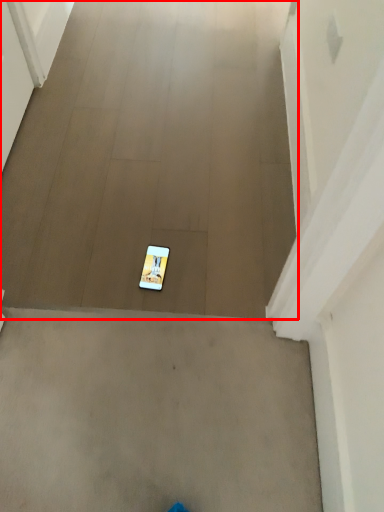
Question: From the image's perspective, considering the relative positions of concrete (annotated by the red box) and mobile phone in the image provided, where is concrete (annotated by the red box) located with respect to the staircase?

Choices:
 (A) below
 (B) above

Answer: (B)